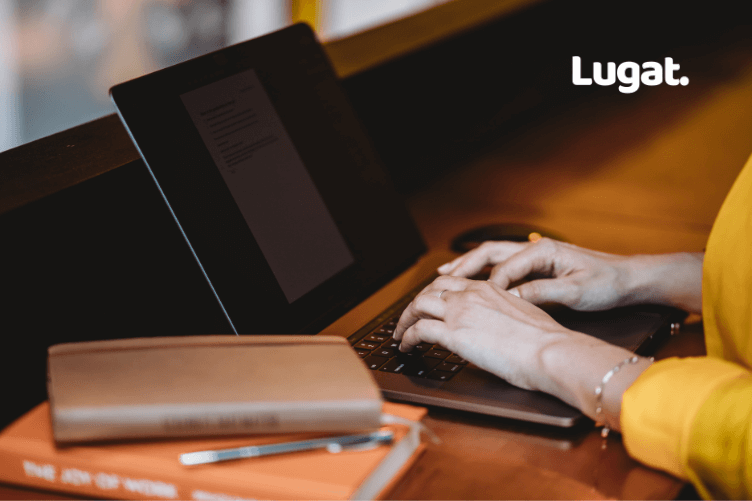
Find the location of `document on monitor`. document on monitor is located at coordinates (259, 186).